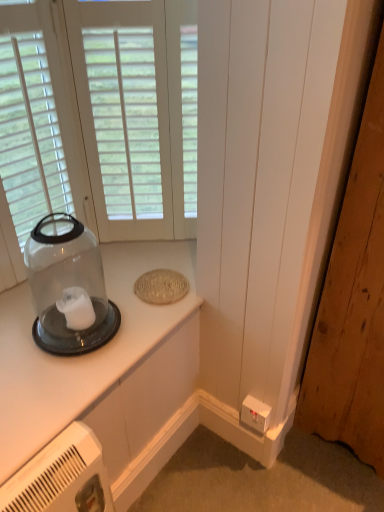
This screenshot has height=512, width=384. I want to click on free point above clear glass jar at upper left (from a real-world perspective), so click(x=85, y=290).